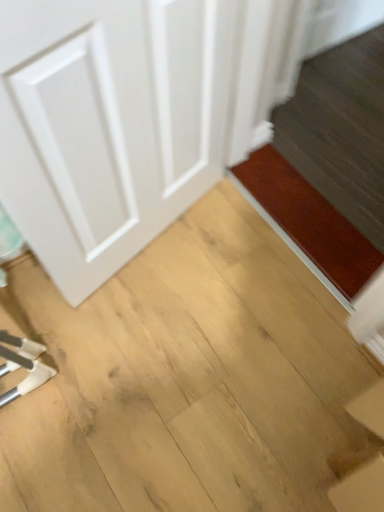
Image resolution: width=384 pixels, height=512 pixels. What are the coordinates of `white matte door at left` in the screenshot? It's located at (108, 125).

Identify the location of brown matte doormat at lower right. This screenshot has width=384, height=512. (309, 220).

Between brown matte doormat at lower right and light brown wood at center, which one appears on the right side from the viewer's perspective?

Answer: From the viewer's perspective, brown matte doormat at lower right appears more on the right side.

From the image's perspective, is brown matte doormat at lower right over light brown wood at center?

Yes, from the image's perspective, brown matte doormat at lower right is over light brown wood at center.

This screenshot has width=384, height=512. In the image, there is a light brown wood at center. Identify the location of doormat above it (from the image's perspective). (309, 220).

Between brown matte doormat at lower right and light brown wood at center, which one has smaller width?

brown matte doormat at lower right.

Based on the photo, from a real-world perspective, who is located lower, light brown wood at center or white matte door at left?

light brown wood at center, from a real-world perspective.

Which of these two, light brown wood at center or white matte door at left, is bigger?

light brown wood at center is bigger.

Looking at this image, how many degrees apart are the facing directions of light brown wood at center and white matte door at left?

There is a 68.3-degree angle between the facing directions of light brown wood at center and white matte door at left.

Image resolution: width=384 pixels, height=512 pixels. What are the coordinates of `doormat that is above the light brown wood at center (from the image's perspective)` in the screenshot? It's located at pyautogui.click(x=309, y=220).

Can you confirm if light brown wood at center is smaller than brown matte doormat at lower right?

No, light brown wood at center is not smaller than brown matte doormat at lower right.

Is point (86, 425) positioned behind point (245, 170)?

No, it is not.

How far apart are light brown wood at center and brown matte doormat at lower right?

light brown wood at center is 15.21 inches from brown matte doormat at lower right.

Between white matte door at left and brown matte doormat at lower right, which one appears on the right side from the viewer's perspective?

Positioned to the right is brown matte doormat at lower right.

Would you say white matte door at left is outside brown matte doormat at lower right?

white matte door at left is positioned outside brown matte doormat at lower right.

Which is nearer, (171, 189) or (372, 257)?

The point (171, 189) is more forward.

Consider the image. Is white matte door at left aimed at brown matte doormat at lower right?

No, white matte door at left is not turned towards brown matte doormat at lower right.

Based on the photo, from the image's perspective, is brown matte doormat at lower right above or below white matte door at left?

brown matte doormat at lower right is situated lower than white matte door at left in the image.

Is point (304, 226) closer or farther from the camera than point (171, 46)?

Clearly, point (304, 226) is more distant from the camera than point (171, 46).

Between brown matte doormat at lower right and white matte door at left, which one is positioned in front?

white matte door at left is in front.

Is light brown wood at center at the back of white matte door at left?

white matte door at left does not have its back to light brown wood at center.

Does point (60, 142) appear closer or farther from the camera than point (207, 263)?

Clearly, point (60, 142) is closer to the camera than point (207, 263).

I want to click on door above the light brown wood at center (from the image's perspective), so click(108, 125).

Looking at this image, considering the relative sizes of white matte door at left and light brown wood at center in the image provided, is white matte door at left bigger than light brown wood at center?

Incorrect, white matte door at left is not larger than light brown wood at center.

This screenshot has height=512, width=384. Find the location of `plywood below the brown matte doormat at lower right (from a real-world perspective)`. plywood below the brown matte doormat at lower right (from a real-world perspective) is located at coordinates (186, 378).

What are the coordinates of `door above the light brown wood at center (from the image's perspective)` in the screenshot? It's located at (108, 125).

Considering their positions, is white matte door at left positioned further to light brown wood at center than brown matte doormat at lower right?

Based on the image, white matte door at left appears to be further to light brown wood at center.

When comparing their distances from white matte door at left, does light brown wood at center or brown matte doormat at lower right seem closer?

The object closer to white matte door at left is light brown wood at center.

From the image, which object appears to be farther from brown matte doormat at lower right, light brown wood at center or white matte door at left?

white matte door at left is further to brown matte doormat at lower right.

From the image, which object appears to be nearer to light brown wood at center, brown matte doormat at lower right or white matte door at left?

brown matte doormat at lower right is closer to light brown wood at center.

When comparing their distances from brown matte doormat at lower right, does white matte door at left or light brown wood at center seem further?

white matte door at left is positioned further to the anchor brown matte doormat at lower right.

Considering their positions, is brown matte doormat at lower right positioned closer to white matte door at left than light brown wood at center?

light brown wood at center is positioned closer to the anchor white matte door at left.

Locate an element on the screen. plywood positioned between white matte door at left and brown matte doormat at lower right from near to far is located at coordinates coord(186,378).